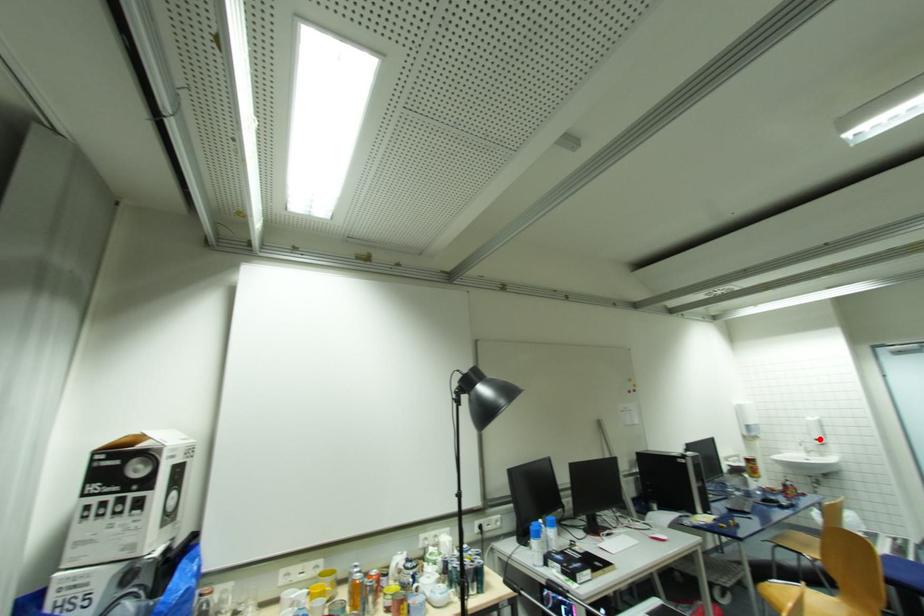
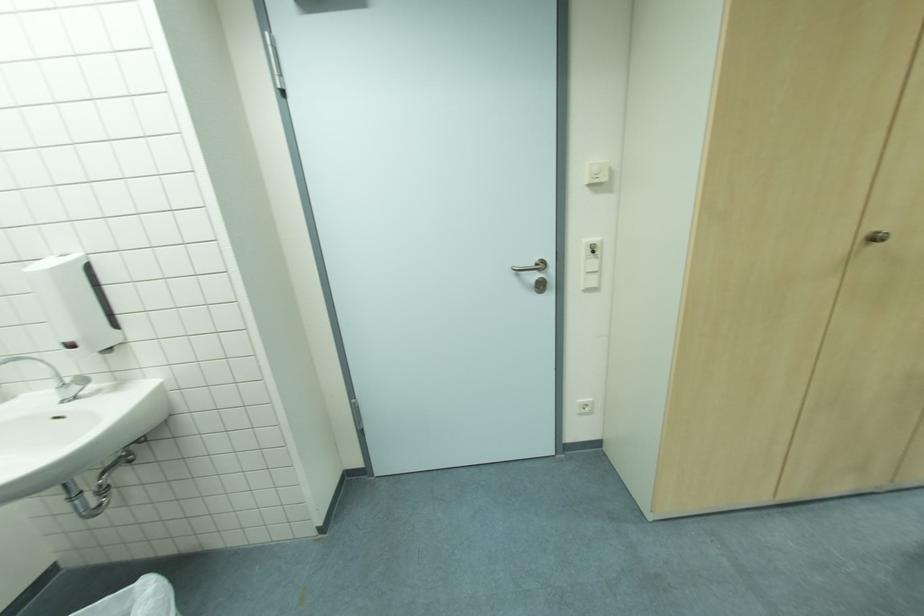
The point at the highlighted location is marked in the first image. Where is the corresponding point in the second image?

(71, 341)